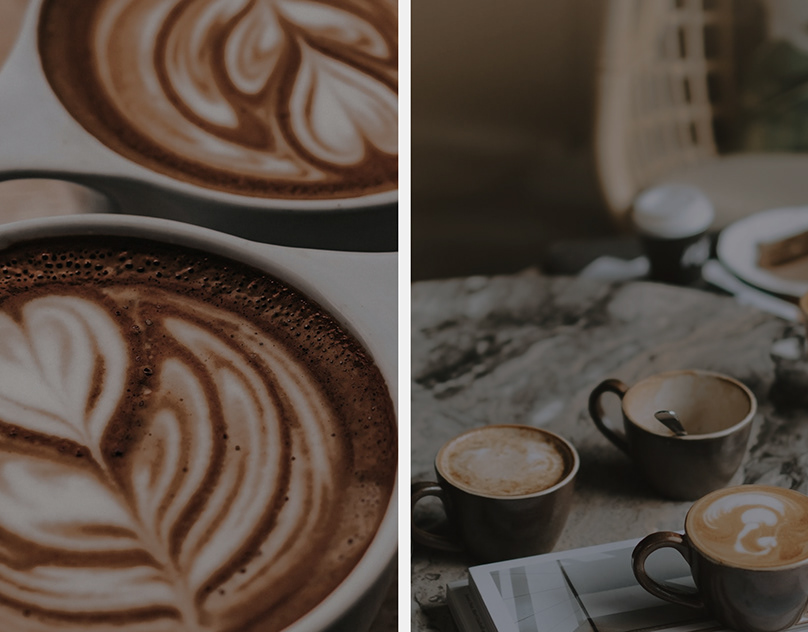
The height and width of the screenshot is (632, 808). I want to click on coffee cups, so click(x=219, y=500), click(x=267, y=112), click(x=667, y=207), click(x=674, y=399), click(x=490, y=453), click(x=779, y=531).